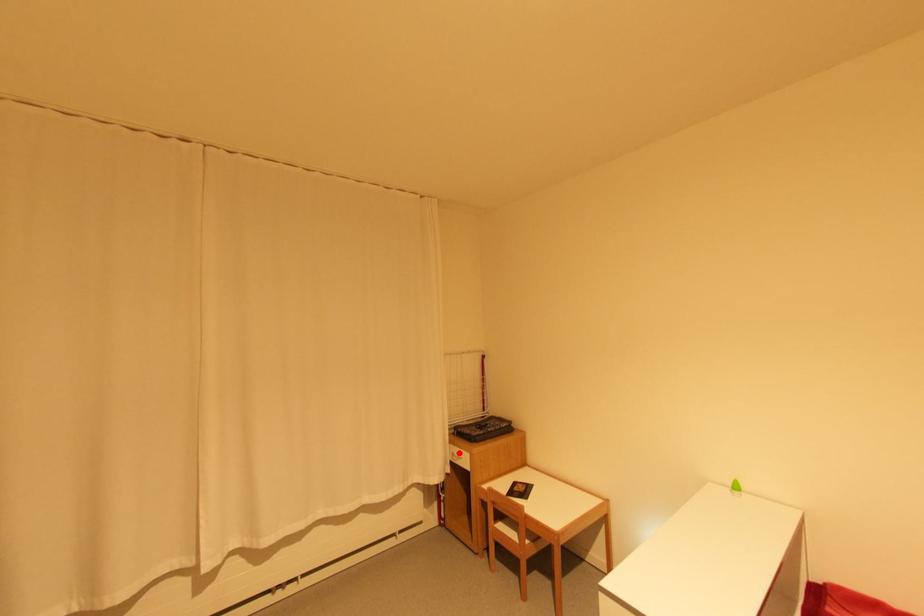
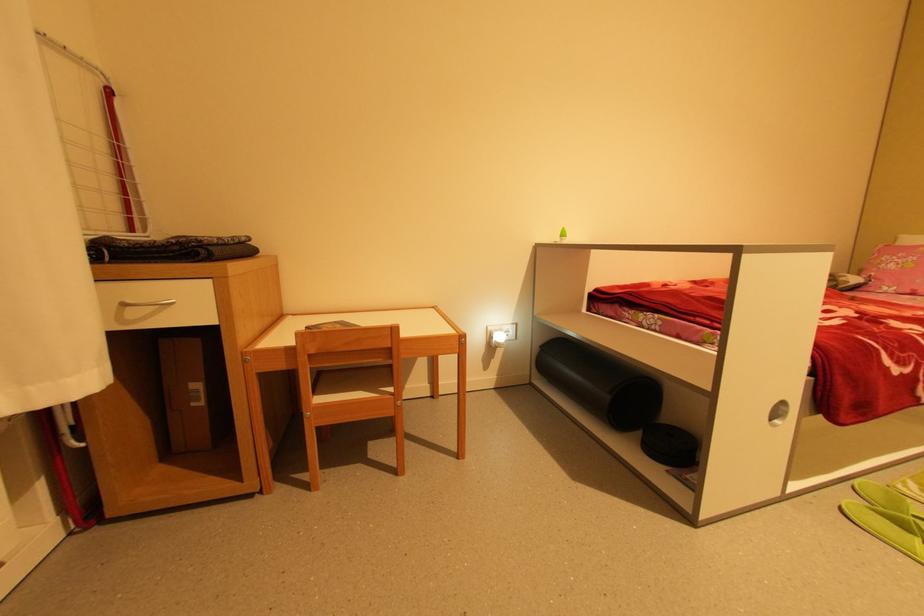
Question: I am providing you with two images of the same scene from different viewpoints. Given a red point in image1, look at the same physical point in image2. Is it:

Choices:
 (A) Closer to the viewpoint
 (B) Farther from the viewpoint

Answer: (A)